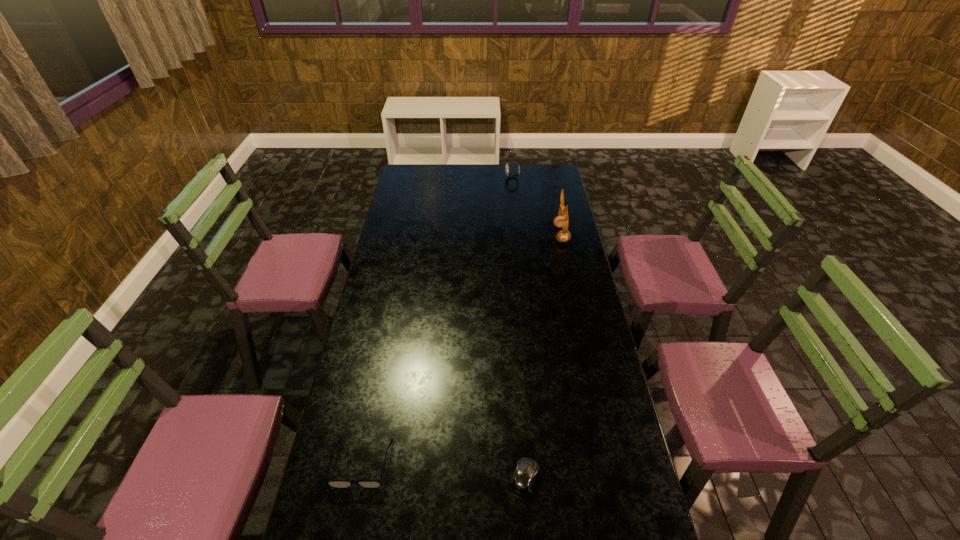
You are a GUI agent. You are given a task and a screenshot of the screen. Output one action in this format:
    pyautogui.click(x=<x>, y=<y>)
    Task: Click on the tallest object
    
    Given the screenshot: What is the action you would take?
    pyautogui.click(x=560, y=221)

You are a GUI agent. You are given a task and a screenshot of the screen. Output one action in this format:
    pyautogui.click(x=<x>, y=<y>)
    Task: Click on the rightmost object
    The image size is (960, 540).
    Given the screenshot: What is the action you would take?
    pyautogui.click(x=560, y=221)

At what (x,y) coordinates should I click in order to perform the action: click on watch. Please return your answer as a coordinate pair (x, y). This screenshot has height=540, width=960. Looking at the image, I should click on (512, 162).

Identify the location of the third shortest object. (512, 162).

Locate an element on the screen. the leftmost object is located at coordinates (338, 484).

You are a GUI agent. You are given a task and a screenshot of the screen. Output one action in this format:
    pyautogui.click(x=<x>, y=<y>)
    Task: Click on the mouse
    The image size is (960, 540).
    Given the screenshot: What is the action you would take?
    pyautogui.click(x=523, y=480)

The height and width of the screenshot is (540, 960). What are the coordinates of `vacant space situated on the front-facing side of the earphone` in the screenshot? It's located at (495, 234).

Where is `free spot located 0.350m on the front-facing side of the earphone`? free spot located 0.350m on the front-facing side of the earphone is located at coordinates (481, 234).

The image size is (960, 540). In order to click on vacant space located on the front-facing side of the earphone in this screenshot , I will do `click(531, 234)`.

Identify the location of free point located on the face of the farthest object. (444, 177).